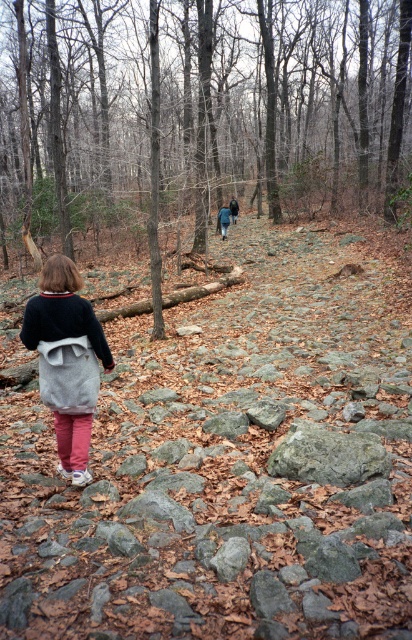
Question: Is rough textured rocks at center closer to camera compared to gray rough rock at center?

Choices:
 (A) no
 (B) yes

Answer: (B)

Question: Can you confirm if rough textured rocks at center is wider than gray rough rock at center?

Choices:
 (A) no
 (B) yes

Answer: (B)

Question: Is brown rocky trail at center wider than gray fabric backpack at center?

Choices:
 (A) yes
 (B) no

Answer: (A)

Question: Which object is closer to the camera taking this photo?

Choices:
 (A) rough textured rocks at center
 (B) gray rough rock at center
 (C) brown rocky trail at center
 (D) gray fabric backpack at center

Answer: (A)

Question: Among these objects, which one is farthest from the camera?

Choices:
 (A) gray fabric backpack at center
 (B) gray rough rock at center
 (C) rough textured rocks at center
 (D) brown rocky trail at center

Answer: (D)

Question: Which object appears closest to the camera in this image?

Choices:
 (A) rough textured rocks at center
 (B) gray rough rock at center
 (C) gray fabric backpack at center
 (D) brown rocky trail at center

Answer: (A)